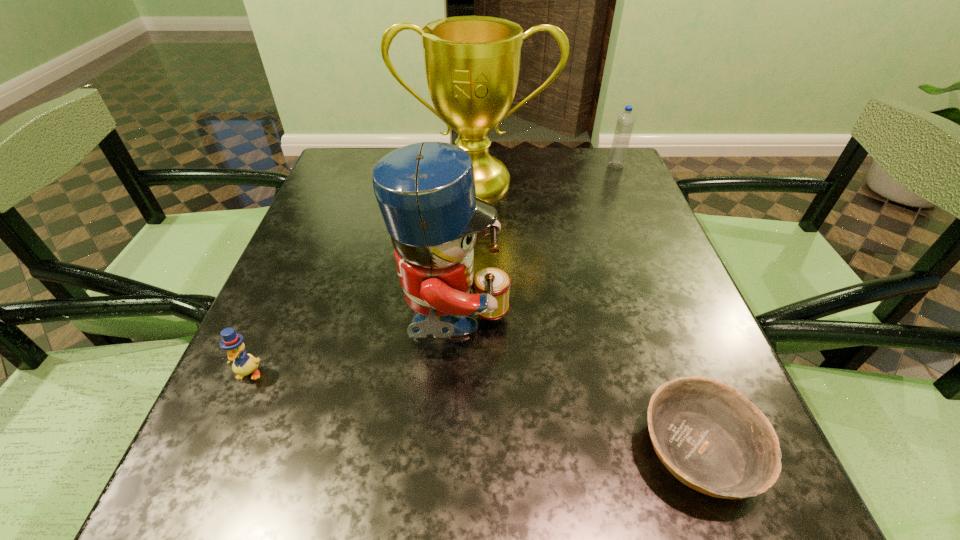
This screenshot has height=540, width=960. I want to click on free space at the far edge of the desktop, so 516,183.

In the image, there is a desktop. Where is `free space at the near edge`? The height and width of the screenshot is (540, 960). free space at the near edge is located at coordinates (311, 465).

Locate an element on the screen. free space at the left edge of the desktop is located at coordinates (300, 306).

The width and height of the screenshot is (960, 540). Find the location of `free location at the right edge of the desktop`. free location at the right edge of the desktop is located at coordinates (x=614, y=224).

At what (x,y) coordinates should I click in order to perform the action: click on vacant region at the far left corner of the desktop. Please return your answer as a coordinate pair (x, y). This screenshot has height=540, width=960. Looking at the image, I should click on (338, 168).

The image size is (960, 540). In order to click on free space between the nutcracker and the duckling in this screenshot , I will do `click(351, 349)`.

The height and width of the screenshot is (540, 960). Identify the location of vacant area that lies between the shortest object and the water bottle. (657, 308).

Identify the location of free space between the nearest object and the leftmost object. (473, 411).

Identify the location of vacant area that lies between the third tallest object and the bowl. The width and height of the screenshot is (960, 540). (657, 308).

This screenshot has width=960, height=540. Identify the location of free point between the nearest object and the award. (587, 315).